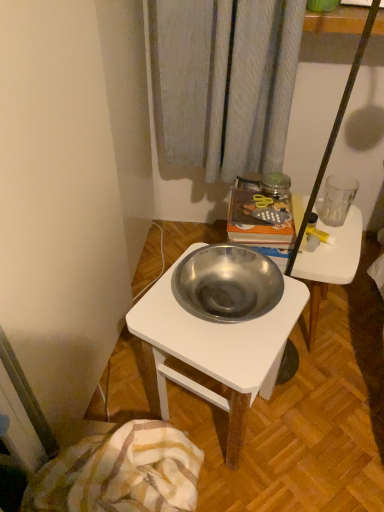
You are a GUI agent. You are given a task and a screenshot of the screen. Output one action in this format:
    pyautogui.click(x=<x>, y=<y>)
    Task: Click on the blank space situated above metallic silver bowl at center (from a real-world perspective)
    This screenshot has height=512, width=384.
    Given the screenshot: What is the action you would take?
    pyautogui.click(x=325, y=240)